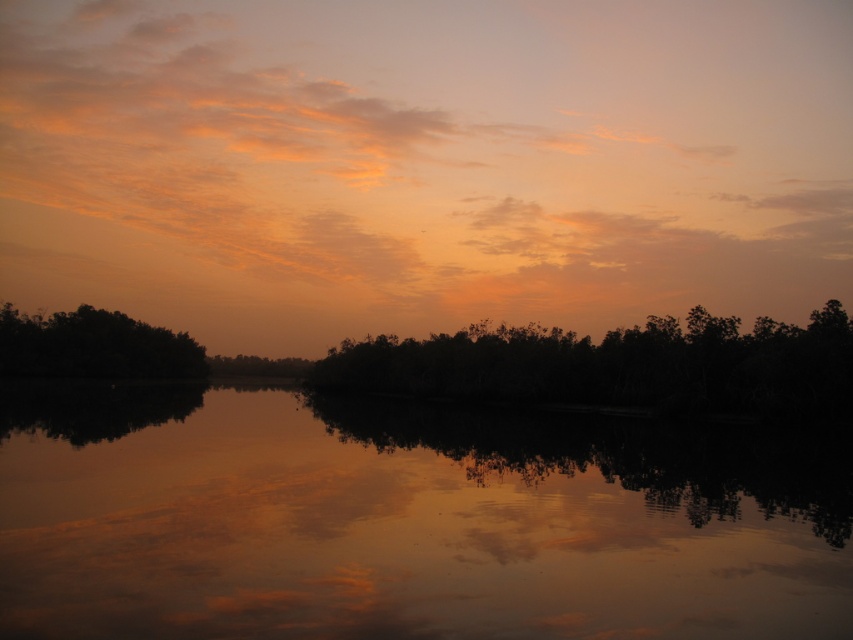
You are standing at the edge of the water and want to walk to the smooth reflective water at center. Which direction should you go?

You should walk towards the center of the water to reach the smooth reflective water at center.

You are standing at the center of the water and looking towards the orange matte cloud at upper center. According to the coordinates provided, is the cloud positioned closer to the top or the bottom of the image?

The orange matte cloud at upper center is located at point coordinates with a y value of 0.497, which is very close to the middle of the image vertically. However, since it is described as being at upper center, it is slightly closer to the top than the bottom.